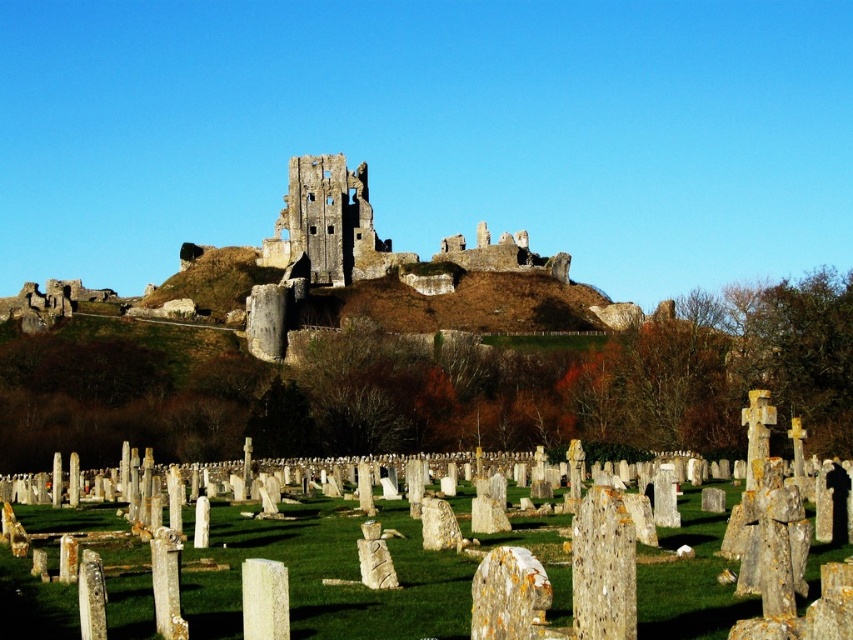
You are a tourist visiting Corfe Castle and its surrounding cemetery. You notice the speckled stone gravestones at center and the rustic stone castle at center. Which object occupies a larger physical space in the image?

The speckled stone gravestones at center is bigger than the rustic stone castle at center, so the gravestones occupy a larger physical space in the image.

From the picture: You are standing at the entrance of Corfe Castle ruins and notice a point marked at coordinates (403, 580). What object does this point correspond to in the scene?

The point corresponds to the speckled stone gravestones at center.

You are a tour guide explaining the historical significance of the site to visitors. You point out the speckled stone gravestones at center and the rustic stone castle at center. Which structure do you think is wider based on their appearance?

The speckled stone gravestones at center might be wider than rustic stone castle at center according to the description.